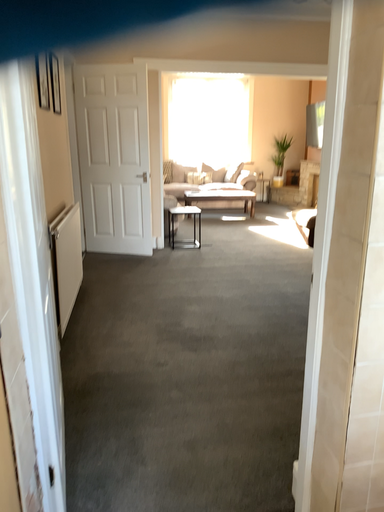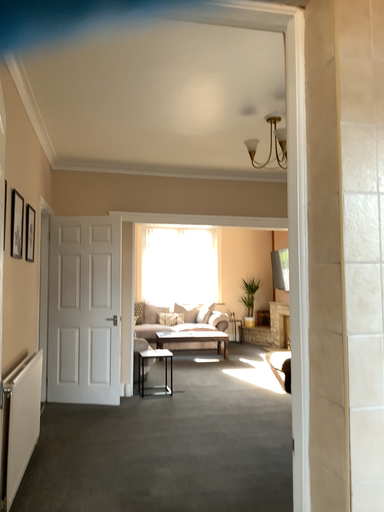
Question: How did the camera likely rotate when shooting the video?

Choices:
 (A) rotated upward
 (B) rotated downward

Answer: (A)